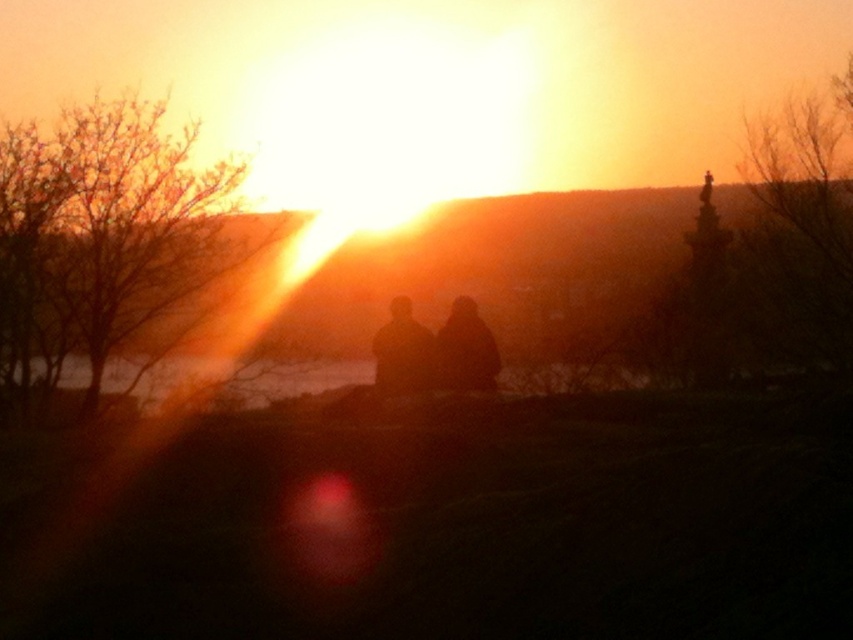
Between silhouette figures at center and silhouette figure at center, which one is positioned lower?

silhouette figures at center

Image resolution: width=853 pixels, height=640 pixels. What are the coordinates of `silhouette figures at center` in the screenshot? It's located at (434, 349).

In order to click on silhouette figures at center in this screenshot , I will do `click(434, 349)`.

Does point (393, 320) lie behind point (432, 356)?

Yes, it is.

What do you see at coordinates (434, 349) in the screenshot? I see `silhouette figures at center` at bounding box center [434, 349].

The image size is (853, 640). I want to click on silhouette figures at center, so click(434, 349).

Does silhouette figure at center come in front of black matte figure at center?

No, it is not.

Is point (483, 387) farther from viewer compared to point (395, 342)?

No.

Find the location of a particular element. This screenshot has width=853, height=640. silhouette figure at center is located at coordinates (466, 349).